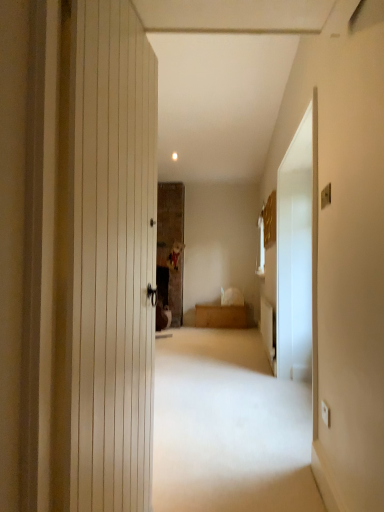
The width and height of the screenshot is (384, 512). What do you see at coordinates (222, 316) in the screenshot? I see `wooden chest at center` at bounding box center [222, 316].

In the scene shown: Measure the distance between point (x=218, y=311) and camera.

A distance of 6.80 meters exists between point (x=218, y=311) and camera.

At what (x,y) coordinates should I click in order to perform the action: click on wooden chest at center. Please return your answer as a coordinate pair (x, y). The height and width of the screenshot is (512, 384). Looking at the image, I should click on (222, 316).

Where is `transparent glass screen door at right`? The image size is (384, 512). transparent glass screen door at right is located at coordinates (295, 256).

Describe the element at coordinates (295, 256) in the screenshot. The height and width of the screenshot is (512, 384). I see `transparent glass screen door at right` at that location.

The image size is (384, 512). Identify the location of wooden chest at center. point(222,316).

Which is more to the right, transparent glass screen door at right or wooden chest at center?

From the viewer's perspective, transparent glass screen door at right appears more on the right side.

Is transparent glass screen door at right closer to camera compared to wooden chest at center?

Yes, transparent glass screen door at right is in front of wooden chest at center.

Which is in front, point (307, 179) or point (236, 317)?

The point (307, 179) is more forward.

From the image's perspective, is transparent glass screen door at right above wooden chest at center?

Correct, transparent glass screen door at right appears higher than wooden chest at center in the image.

From a real-world perspective, who is located higher, transparent glass screen door at right or wooden chest at center?

transparent glass screen door at right is physically above.

Can you confirm if transparent glass screen door at right is wider than wooden chest at center?

In fact, transparent glass screen door at right might be narrower than wooden chest at center.

Who is taller, transparent glass screen door at right or wooden chest at center?

With more height is transparent glass screen door at right.

Which of these two, transparent glass screen door at right or wooden chest at center, is smaller?

transparent glass screen door at right is smaller.

Is transparent glass screen door at right not within wooden chest at center?

Indeed, transparent glass screen door at right is completely outside wooden chest at center.

Is transparent glass screen door at right directly adjacent to wooden chest at center?

transparent glass screen door at right and wooden chest at center are not in contact.

Is transparent glass screen door at right positioned with its back to wooden chest at center?

No, transparent glass screen door at right's orientation is not away from wooden chest at center.

Can you tell me how much transparent glass screen door at right and wooden chest at center differ in facing direction?

They differ by 92.7 degrees in their facing directions.

How far apart are transparent glass screen door at right and wooden chest at center?

transparent glass screen door at right is 9.67 feet from wooden chest at center.

Locate an element on the screen. furniture lying on the left of transparent glass screen door at right is located at coordinates [222, 316].

Can you confirm if wooden chest at center is positioned to the right of transparent glass screen door at right?

No.

Considering the positions of objects wooden chest at center and transparent glass screen door at right in the image provided, who is in front, wooden chest at center or transparent glass screen door at right?

transparent glass screen door at right is more forward.

Which point is more forward, (203, 311) or (297, 131)?

The point (297, 131) is more forward.

From the image's perspective, is wooden chest at center above or below transparent glass screen door at right?

From the image's perspective, wooden chest at center appears below transparent glass screen door at right.

From a real-world perspective, is wooden chest at center under transparent glass screen door at right?

Yes.

Can you confirm if wooden chest at center is thinner than transparent glass screen door at right?

In fact, wooden chest at center might be wider than transparent glass screen door at right.

Does wooden chest at center have a greater height compared to transparent glass screen door at right?

Incorrect, the height of wooden chest at center is not larger of that of transparent glass screen door at right.

Considering the sizes of objects wooden chest at center and transparent glass screen door at right in the image provided, who is smaller, wooden chest at center or transparent glass screen door at right?

Smaller between the two is transparent glass screen door at right.

Would you say wooden chest at center is outside transparent glass screen door at right?

Yes, wooden chest at center is outside of transparent glass screen door at right.

Are wooden chest at center and transparent glass screen door at right far apart?

Absolutely, wooden chest at center is distant from transparent glass screen door at right.

Could you tell me if wooden chest at center is turned towards transparent glass screen door at right?

Yes.

In the image, there is a transparent glass screen door at right. Identify the location of furniture below it (from a real-world perspective). (222, 316).

You are a GUI agent. You are given a task and a screenshot of the screen. Output one action in this format:
    pyautogui.click(x=<x>, y=<y>)
    Task: Click on the screen door above the wooden chest at center (from a real-world perspective)
    Image resolution: width=384 pixels, height=512 pixels.
    Given the screenshot: What is the action you would take?
    pyautogui.click(x=295, y=256)

Identify the location of furniture behind the transparent glass screen door at right. The height and width of the screenshot is (512, 384). (222, 316).